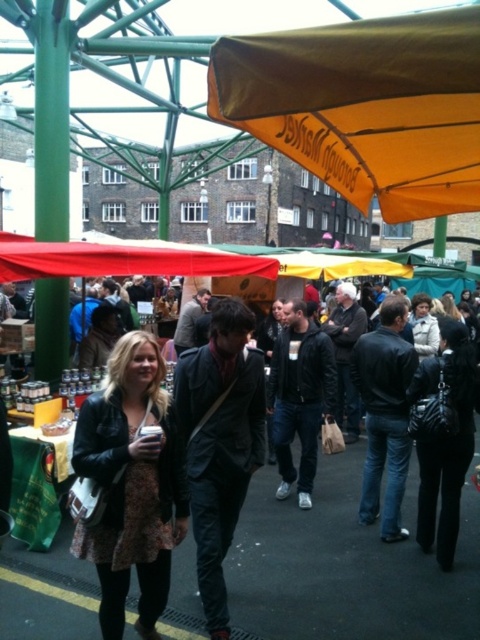
Question: Does orange fabric canopy at upper center lie in front of leather jacket at center?

Choices:
 (A) no
 (B) yes

Answer: (B)

Question: Is orange fabric canopy at upper center further to the viewer compared to leather jacket at center?

Choices:
 (A) no
 (B) yes

Answer: (A)

Question: Which of the following is the farthest from the observer?

Choices:
 (A) leather jacket at center
 (B) orange fabric canopy at upper center

Answer: (A)

Question: Which point is closer to the camera taking this photo?

Choices:
 (A) (118, 545)
 (B) (235, 108)

Answer: (B)

Question: Which point appears closest to the camera in this image?

Choices:
 (A) (312, 64)
 (B) (166, 564)

Answer: (A)

Question: Does orange fabric canopy at upper center have a greater width compared to leather jacket at center?

Choices:
 (A) no
 (B) yes

Answer: (B)